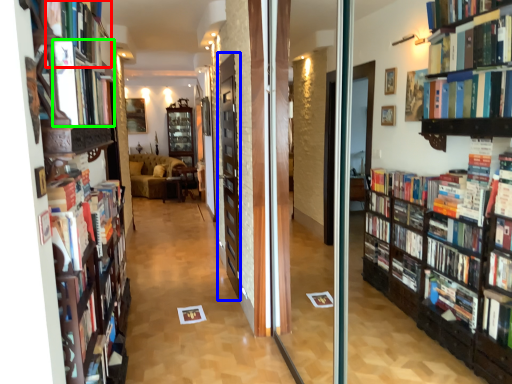
Question: Which object is positioned closest to book (highlighted by a red box)? Select from screen door (highlighted by a blue box) and book (highlighted by a green box).

Choices:
 (A) screen door
 (B) book

Answer: (B)